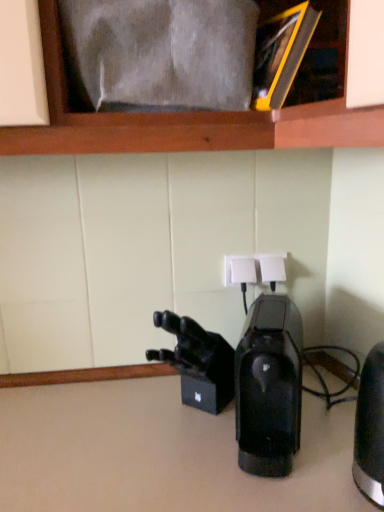
Question: Does black matte/video camera at center have a smaller size compared to black metallic kettle at right, which is counted as the 2th home appliance, starting from the left?

Choices:
 (A) no
 (B) yes

Answer: (B)

Question: Does black matte/video camera at center lie in front of black metallic kettle at right, which is counted as the 1th home appliance, starting from the right?

Choices:
 (A) yes
 (B) no

Answer: (B)

Question: Are black matte/video camera at center and black metallic kettle at right, which is counted as the 2th home appliance, starting from the left, located far from each other?

Choices:
 (A) no
 (B) yes

Answer: (A)

Question: From a real-world perspective, is black matte/video camera at center under black metallic kettle at right, which is counted as the 1th home appliance, starting from the right?

Choices:
 (A) no
 (B) yes

Answer: (B)

Question: Could you tell me if black matte/video camera at center is facing black metallic kettle at right, which is counted as the 1th home appliance, starting from the right?

Choices:
 (A) no
 (B) yes

Answer: (A)

Question: Looking at their shapes, would you say black glossy coffee maker at center, marked as the second home appliance in a right-to-left arrangement, is wider or thinner than black matte/video camera at center?

Choices:
 (A) thin
 (B) wide

Answer: (B)

Question: Is black glossy coffee maker at center, the 1th home appliance when ordered from left to right, taller or shorter than black matte/video camera at center?

Choices:
 (A) tall
 (B) short

Answer: (A)

Question: From the image's perspective, is black glossy coffee maker at center, marked as the second home appliance in a right-to-left arrangement, positioned above or below black matte/video camera at center?

Choices:
 (A) above
 (B) below

Answer: (B)

Question: Considering the positions of point (286, 318) and point (175, 332), is point (286, 318) closer or farther from the camera than point (175, 332)?

Choices:
 (A) closer
 (B) farther

Answer: (B)

Question: From the image's perspective, is black metallic kettle at right, which is counted as the 1th home appliance, starting from the right, positioned above or below black glossy coffee maker at center, the 1th home appliance when ordered from left to right?

Choices:
 (A) below
 (B) above

Answer: (A)

Question: In the image, is black metallic kettle at right, which is counted as the 2th home appliance, starting from the left, on the left side or the right side of black glossy coffee maker at center, the 1th home appliance when ordered from left to right?

Choices:
 (A) left
 (B) right

Answer: (B)

Question: Is black metallic kettle at right, which is counted as the 2th home appliance, starting from the left, wider or thinner than black glossy coffee maker at center, marked as the second home appliance in a right-to-left arrangement?

Choices:
 (A) wide
 (B) thin

Answer: (B)

Question: Does point (377, 441) appear closer or farther from the camera than point (269, 425)?

Choices:
 (A) farther
 (B) closer

Answer: (B)

Question: Is black glossy coffee maker at center, the 1th home appliance when ordered from left to right, wider or thinner than black metallic kettle at right, which is counted as the 1th home appliance, starting from the right?

Choices:
 (A) thin
 (B) wide

Answer: (B)

Question: Relative to black metallic kettle at right, which is counted as the 1th home appliance, starting from the right, is black glossy coffee maker at center, the 1th home appliance when ordered from left to right, in front or behind?

Choices:
 (A) behind
 (B) front

Answer: (A)